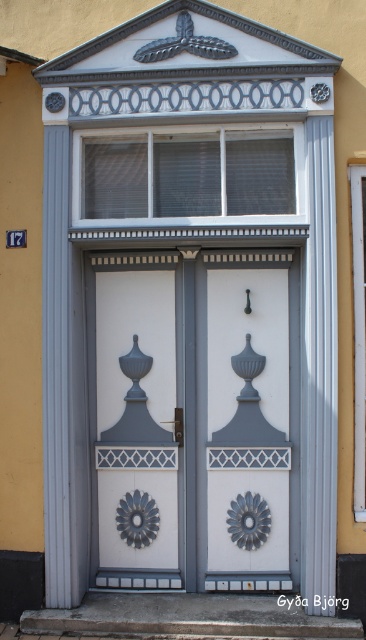
Between point (196, 454) and point (274, 200), which one is positioned behind?

Point (196, 454)

Is point (244, 310) closer to viewer compared to point (166, 163)?

No.

Which is behind, point (114, 376) or point (98, 145)?

The point (114, 376) is more distant.

You are a GUI agent. You are given a task and a screenshot of the screen. Output one action in this format:
    pyautogui.click(x=<x>, y=<y>)
    Task: Click on the white painted wood door at center
    
    Given the screenshot: What is the action you would take?
    coord(193,420)

Does point (260, 316) come farther from viewer compared to point (263, 468)?

No.

Based on the photo, is white painted wood door at center to the right of white glossy door at center from the viewer's perspective?

No, white painted wood door at center is not to the right of white glossy door at center.

Between point (289, 396) and point (285, 385), which one is positioned behind?

The point (285, 385) is behind.

The height and width of the screenshot is (640, 366). I want to click on white painted wood door at center, so click(193, 420).

Can you confirm if white painted wood door at center is thinner than matte gray door at center?

Incorrect, white painted wood door at center's width is not less than matte gray door at center's.

Can you confirm if white painted wood door at center is taller than matte gray door at center?

Yes.

Which is in front, point (286, 577) or point (148, 444)?

Point (286, 577) is in front.

I want to click on white painted wood door at center, so click(x=193, y=420).